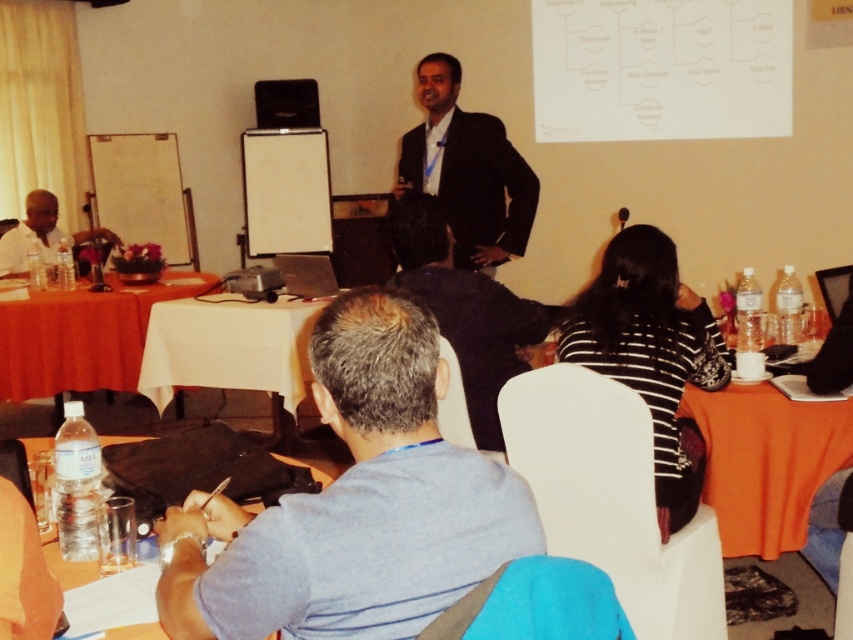
Question: Is gray fabric shirt at center wider than clear plastic water bottle at lower left?

Choices:
 (A) yes
 (B) no

Answer: (A)

Question: Does dark blue shirt at center appear on the left side of white shirt at left?

Choices:
 (A) yes
 (B) no

Answer: (B)

Question: Is orange fabric table at lower left thinner than clear plastic water bottle at lower left?

Choices:
 (A) no
 (B) yes

Answer: (A)

Question: Which point is farther to the camera?

Choices:
 (A) (521, 230)
 (B) (811, 474)

Answer: (A)

Question: Which point is closer to the camera taking this photo?

Choices:
 (A) [x=181, y=596]
 (B) [x=39, y=244]
 (C) [x=462, y=298]

Answer: (A)

Question: Which point is farther from the camera taking this photo?

Choices:
 (A) (434, 268)
 (B) (683, 403)

Answer: (A)